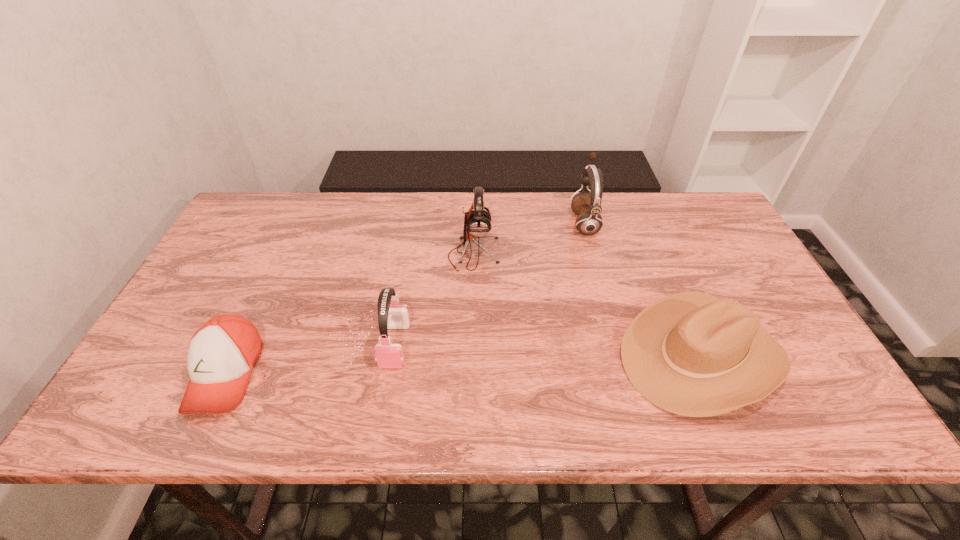
This screenshot has height=540, width=960. I want to click on vacant space that satisfies the following two spatial constraints: 1. on the ear pads of the rightmost earphone; 2. on the front-facing side of the leftmost object, so click(625, 374).

Find the location of `free space that satisfies the following two spatial constraints: 1. on the ear pads of the rightmost earphone; 2. on the right side of the fourth tallest object`. free space that satisfies the following two spatial constraints: 1. on the ear pads of the rightmost earphone; 2. on the right side of the fourth tallest object is located at coordinates (620, 355).

Identify the location of free space that satisfies the following two spatial constraints: 1. on the back side of the cowboy hat; 2. on the ear pads of the rightmost earphone. (644, 222).

Find the location of `vacant area that satisfies the following two spatial constraints: 1. on the outer surface of the shortest earphone; 2. on the left side of the cowboy hat`. vacant area that satisfies the following two spatial constraints: 1. on the outer surface of the shortest earphone; 2. on the left side of the cowboy hat is located at coordinates (394, 355).

Where is `vacant space that satisfies the following two spatial constraints: 1. on the ear pads of the rightmost earphone; 2. on the front-facing side of the shortest object`? The width and height of the screenshot is (960, 540). vacant space that satisfies the following two spatial constraints: 1. on the ear pads of the rightmost earphone; 2. on the front-facing side of the shortest object is located at coordinates (625, 374).

Identify the location of vacant space that satisfies the following two spatial constraints: 1. on the ear pads of the rightmost earphone; 2. on the outer surface of the shortest earphone. The width and height of the screenshot is (960, 540). tap(617, 345).

This screenshot has height=540, width=960. I want to click on vacant space that satisfies the following two spatial constraints: 1. on the ear pads of the rightmost earphone; 2. on the outer surface of the nearest earphone, so (x=617, y=345).